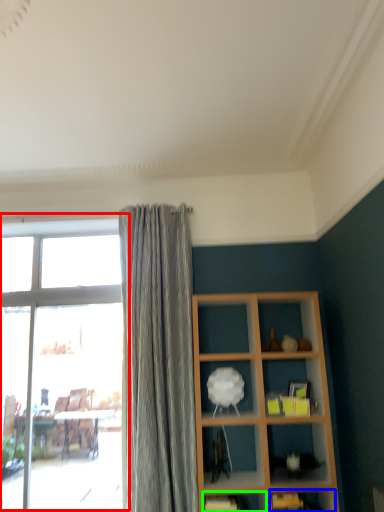
Question: Based on their relative distances, which object is farther from window (highlighted by a red box)? Choose from shelf (highlighted by a blue box) and shelf (highlighted by a green box).

Choices:
 (A) shelf
 (B) shelf

Answer: (A)